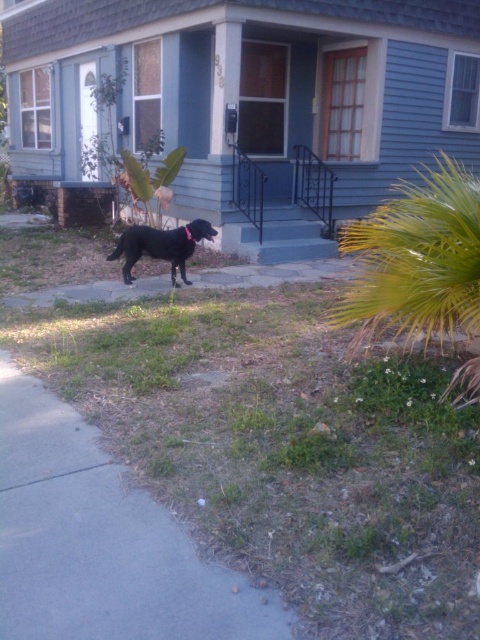
You are standing in front of the house and want to walk to the gray concrete pavement at lower left. Is the black matte dog at center blocking your path?

The gray concrete pavement at lower left is closer to the viewer than the black matte dog at center, so the black matte dog at center is behind the pavement and not blocking the path.